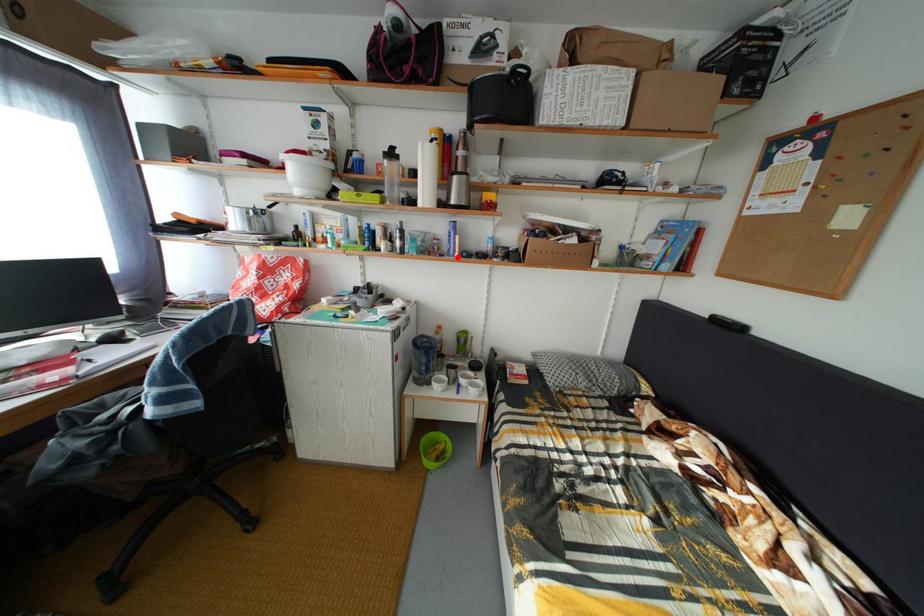
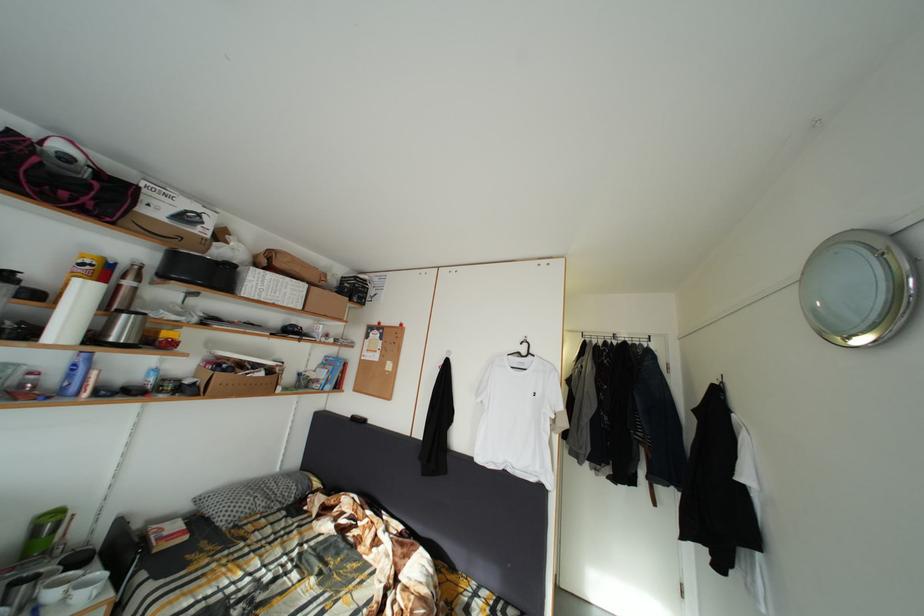
Locate, in the second image, the point that corresponds to the highlighted location in the first image.

(73, 395)